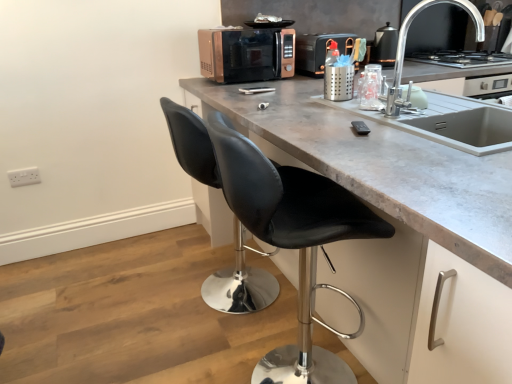
Locate an element on the screen. The image size is (512, 384). free space that is in between black leather swivel chair at center and black leather stool at center is located at coordinates (250, 329).